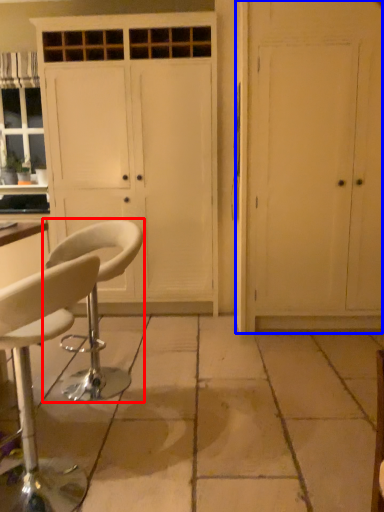
Question: Which object appears closest to the camera in this image, chair (highlighted by a red box) or door (highlighted by a blue box)?

Choices:
 (A) chair
 (B) door

Answer: (A)